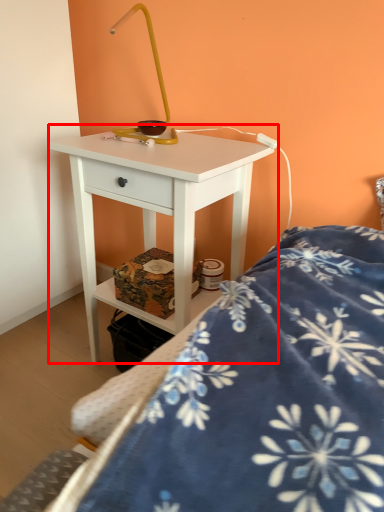
Question: From the image's perspective, what is the correct spatial positioning of nightstand (annotated by the red box) in reference to bed?

Choices:
 (A) above
 (B) below

Answer: (A)